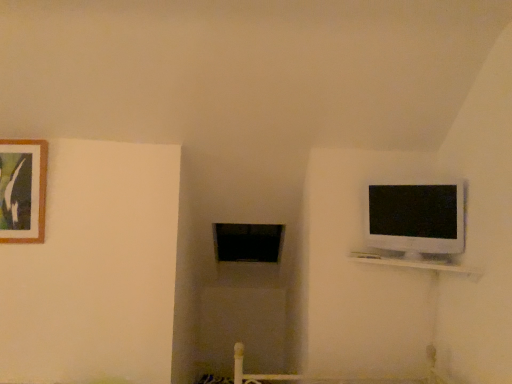
Question: From a real-world perspective, does white glossy shelf at upper right sit lower than white glossy television at upper right?

Choices:
 (A) yes
 (B) no

Answer: (A)

Question: Is white glossy shelf at upper right to the right of white glossy television at upper right from the viewer's perspective?

Choices:
 (A) yes
 (B) no

Answer: (B)

Question: From a real-world perspective, is white glossy shelf at upper right located higher than white glossy television at upper right?

Choices:
 (A) yes
 (B) no

Answer: (B)

Question: Can you confirm if white glossy shelf at upper right is thinner than white glossy television at upper right?

Choices:
 (A) yes
 (B) no

Answer: (B)

Question: From the image's perspective, is white glossy shelf at upper right above white glossy television at upper right?

Choices:
 (A) yes
 (B) no

Answer: (B)

Question: Does point (382, 213) appear closer or farther from the camera than point (34, 208)?

Choices:
 (A) farther
 (B) closer

Answer: (B)

Question: In the image, is white glossy television at upper right positioned in front of or behind wooden picture frame at upper left?

Choices:
 (A) behind
 (B) front

Answer: (B)

Question: Considering the relative positions of white glossy television at upper right and wooden picture frame at upper left in the image provided, is white glossy television at upper right to the left or to the right of wooden picture frame at upper left?

Choices:
 (A) right
 (B) left

Answer: (A)

Question: From the image's perspective, is white glossy television at upper right above or below wooden picture frame at upper left?

Choices:
 (A) below
 (B) above

Answer: (A)

Question: In terms of width, does white glossy shelf at upper right look wider or thinner when compared to wooden picture frame at upper left?

Choices:
 (A) thin
 (B) wide

Answer: (B)

Question: From a real-world perspective, is white glossy shelf at upper right above or below wooden picture frame at upper left?

Choices:
 (A) below
 (B) above

Answer: (A)

Question: Is white glossy shelf at upper right bigger or smaller than wooden picture frame at upper left?

Choices:
 (A) big
 (B) small

Answer: (A)

Question: In the image, is white glossy shelf at upper right positioned in front of or behind wooden picture frame at upper left?

Choices:
 (A) front
 (B) behind

Answer: (A)

Question: In the image, is wooden picture frame at upper left on the left side or the right side of white glossy shelf at upper right?

Choices:
 (A) right
 (B) left

Answer: (B)

Question: Is wooden picture frame at upper left taller or shorter than white glossy shelf at upper right?

Choices:
 (A) tall
 (B) short

Answer: (A)